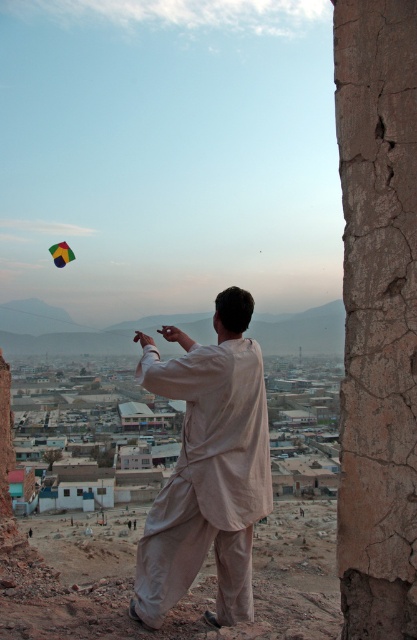
Question: Is light beige cotton kurta at center to the right of multicolored fabric kite at upper left from the viewer's perspective?

Choices:
 (A) no
 (B) yes

Answer: (B)

Question: Is light beige cotton kurta at center further to camera compared to multicolored fabric kite at upper left?

Choices:
 (A) no
 (B) yes

Answer: (A)

Question: Among these objects, which one is nearest to the camera?

Choices:
 (A) light beige cotton kurta at center
 (B) multicolored fabric kite at upper left

Answer: (A)

Question: Which point appears farthest from the camera in this image?

Choices:
 (A) (58, 243)
 (B) (268, 452)

Answer: (A)

Question: In this image, where is light beige cotton kurta at center located relative to multicolored fabric kite at upper left?

Choices:
 (A) above
 (B) below

Answer: (B)